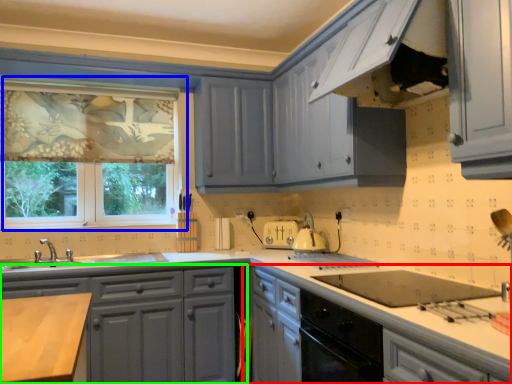
Question: Based on their relative distances, which object is farther from cabinetry (highlighted by a red box)? Choose from window (highlighted by a blue box) and cabinetry (highlighted by a green box).

Choices:
 (A) window
 (B) cabinetry

Answer: (A)